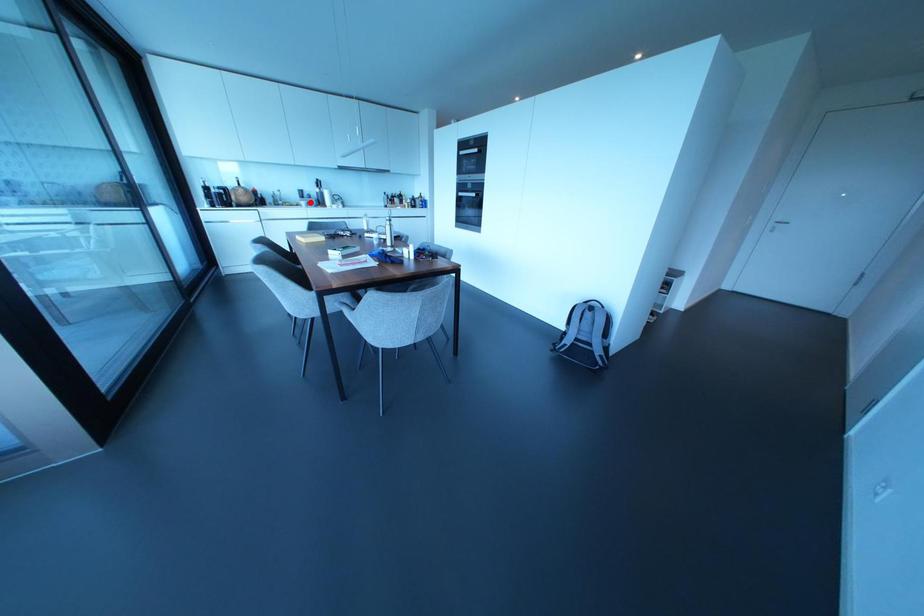
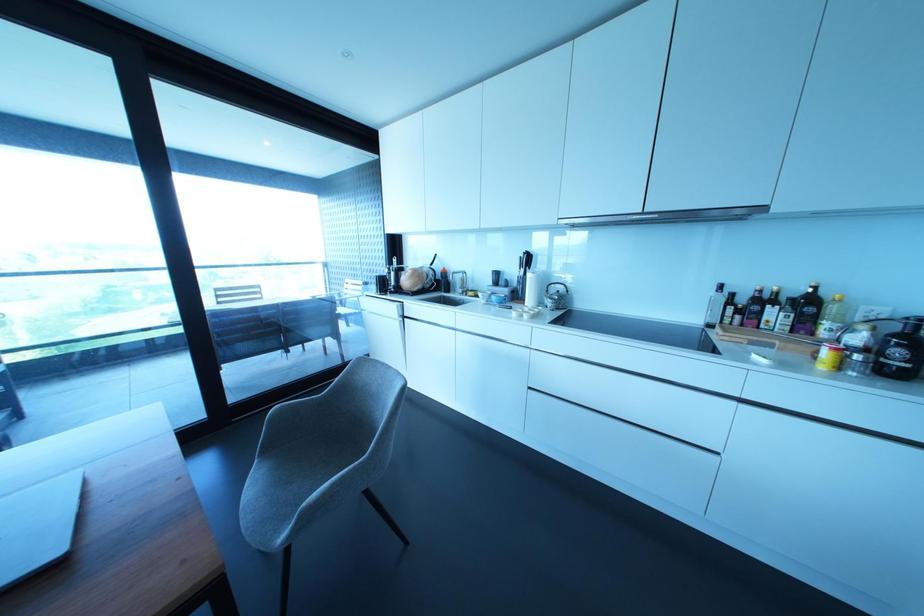
Find the pixel in the second image that matches the highlighted location in the first image.

(492, 297)